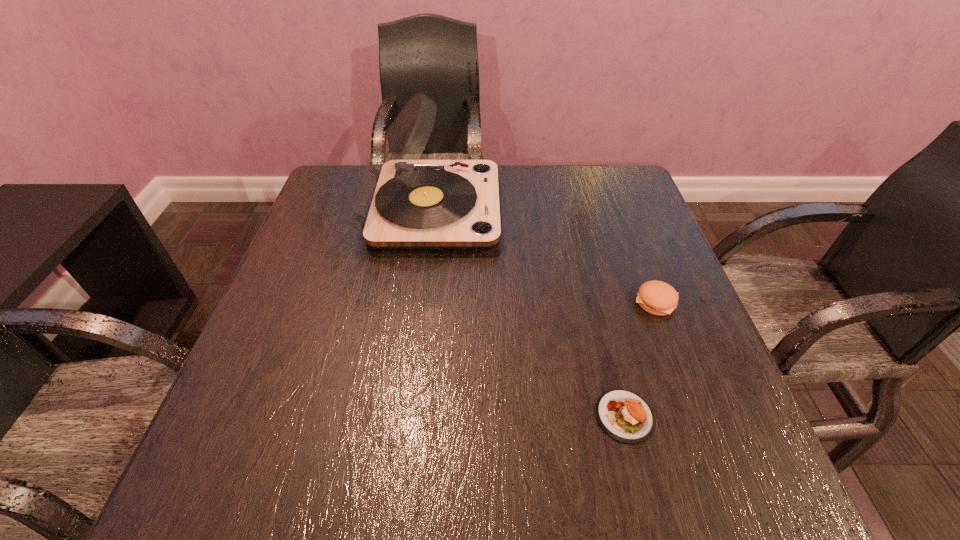
At what (x,y) coordinates should I click in order to perform the action: click on the leftmost object. Please return your answer as a coordinate pair (x, y). Looking at the image, I should click on (402, 202).

The height and width of the screenshot is (540, 960). Find the location of `the tallest object`. the tallest object is located at coordinates (402, 202).

I want to click on the right patty (food), so click(658, 298).

This screenshot has height=540, width=960. Identify the location of the second nearest object. (658, 298).

This screenshot has width=960, height=540. What are the coordinates of `the nearest object` in the screenshot? It's located at (625, 416).

Find the location of `the shortest object`. the shortest object is located at coordinates (625, 416).

This screenshot has height=540, width=960. Identify the location of free spot located with the tonearm facing the front of the farthest object. (526, 209).

This screenshot has height=540, width=960. Find the location of `vacant point located 0.260m on the back of the second tallest object`. vacant point located 0.260m on the back of the second tallest object is located at coordinates (x=622, y=212).

Where is `vacant region located 0.060m on the left of the nearest object`? vacant region located 0.060m on the left of the nearest object is located at coordinates (560, 416).

At what (x,y) coordinates should I click in order to perform the action: click on object that is positioned at the far edge. Please return your answer as a coordinate pair (x, y). The width and height of the screenshot is (960, 540). Looking at the image, I should click on (402, 202).